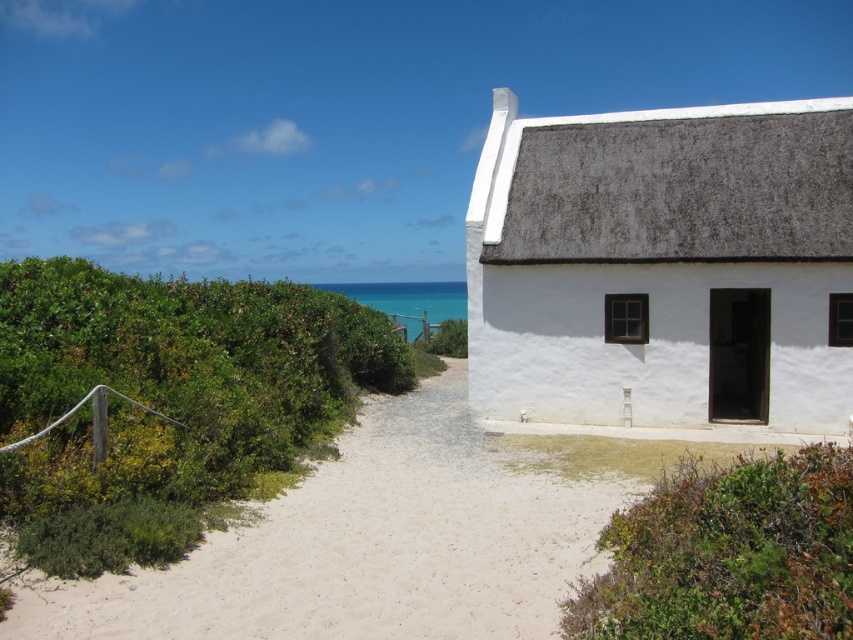
Question: Among these objects, which one is nearest to the camera?

Choices:
 (A) green leafy bush at lower right
 (B) green leafy bush at left
 (C) white thatch roofed cottage at upper right

Answer: (A)

Question: Is green leafy bush at left below white sandy path at center?

Choices:
 (A) no
 (B) yes

Answer: (A)

Question: Which of these objects is positioned closest to the white thatch roofed cottage at upper right?

Choices:
 (A) green leafy bush at lower right
 (B) green leafy bush at left

Answer: (B)

Question: Which object appears closest to the camera in this image?

Choices:
 (A) white sandy path at center
 (B) white thatch roofed cottage at upper right
 (C) green leafy bush at left
 (D) green leafy bush at lower right

Answer: (D)

Question: Does green leafy bush at left have a lesser width compared to green leafy bush at lower right?

Choices:
 (A) no
 (B) yes

Answer: (A)

Question: Is green leafy bush at left wider than green leafy bush at lower right?

Choices:
 (A) yes
 (B) no

Answer: (A)